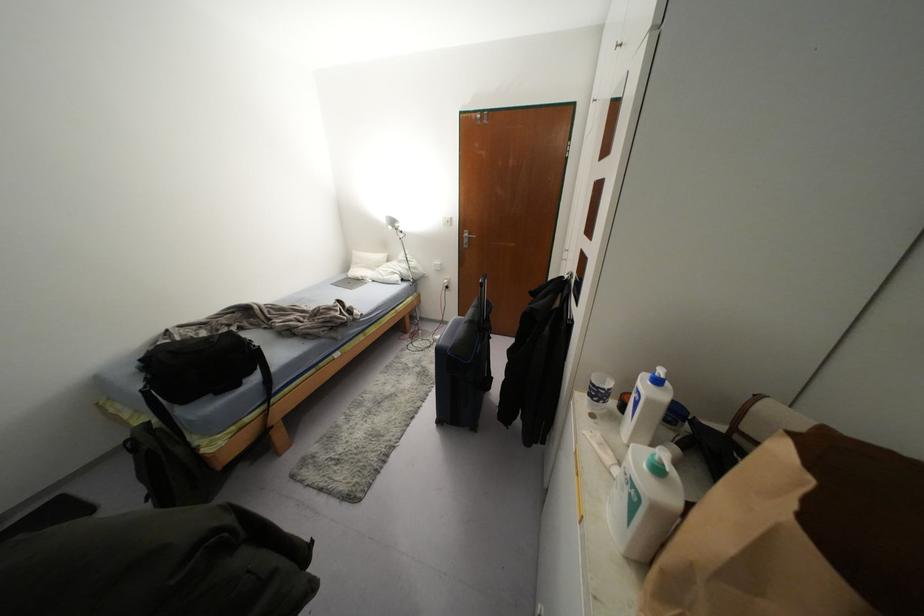
Identify the location of white pillow. The image size is (924, 616). (365, 264).